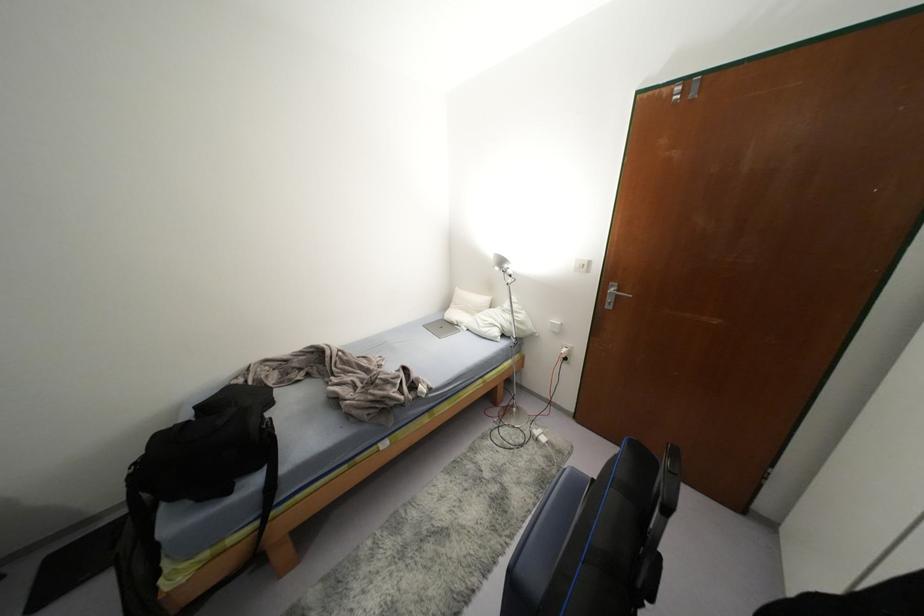
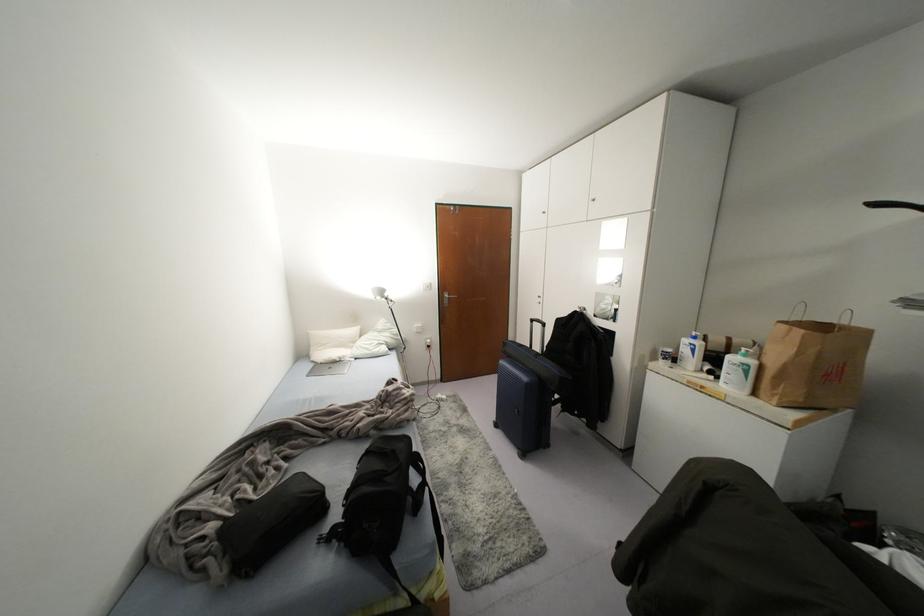
In the second image, find the point that corresponds to point (451, 323) in the first image.

(334, 361)